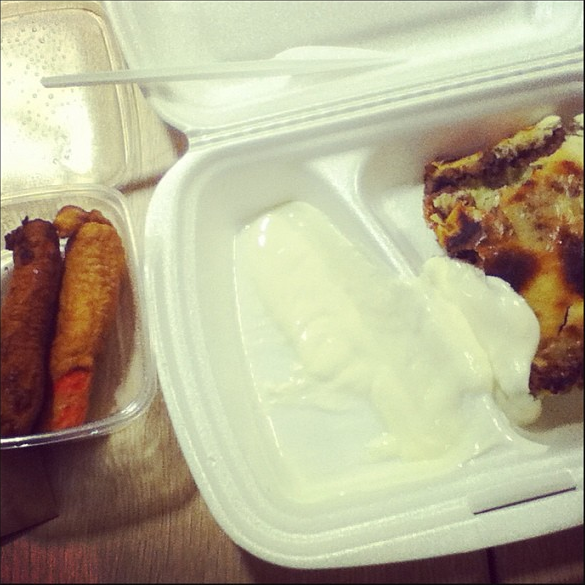
Locate an element on the screen. The width and height of the screenshot is (585, 585). table is located at coordinates (166, 556).